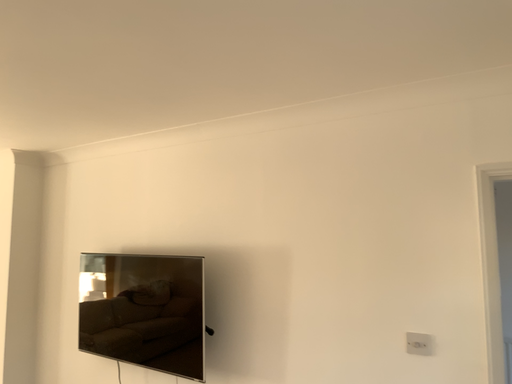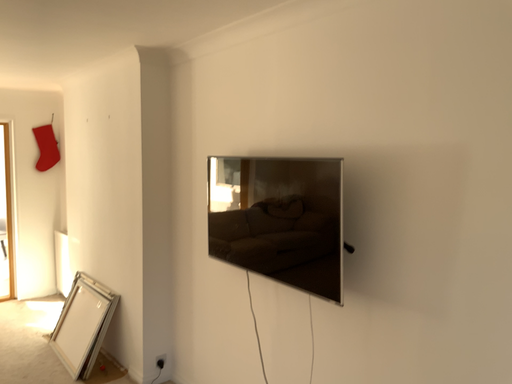
Question: How did the camera likely rotate when shooting the video?

Choices:
 (A) rotated downward
 (B) rotated upward

Answer: (A)